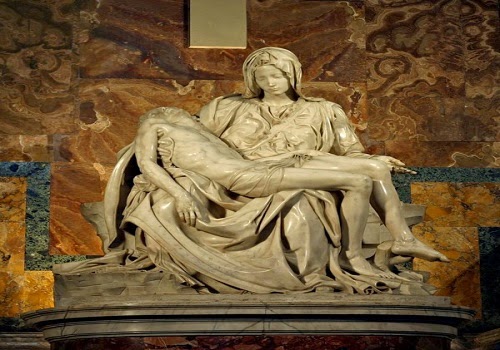
Locate an element on the screen. Image resolution: width=500 pixels, height=350 pixels. wall is located at coordinates (90, 114).